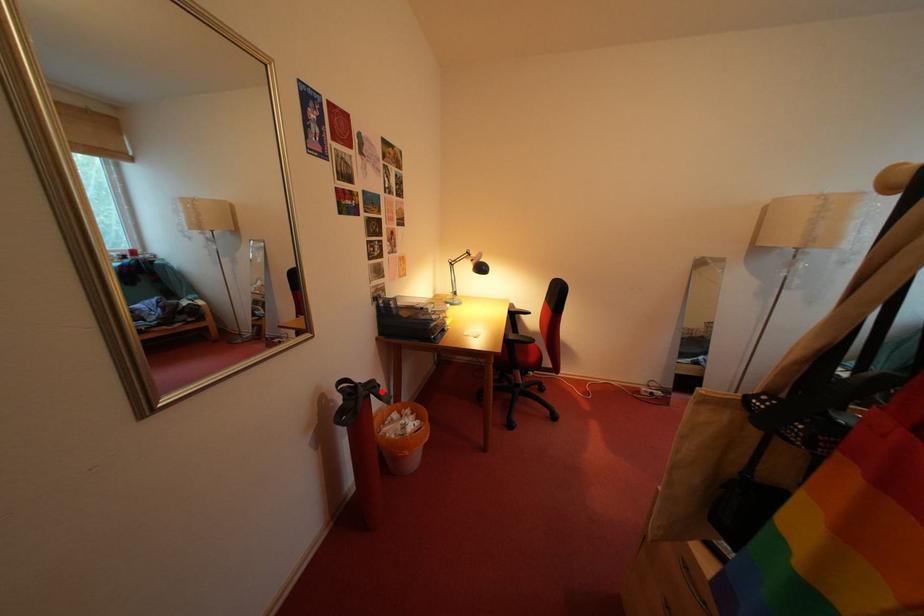
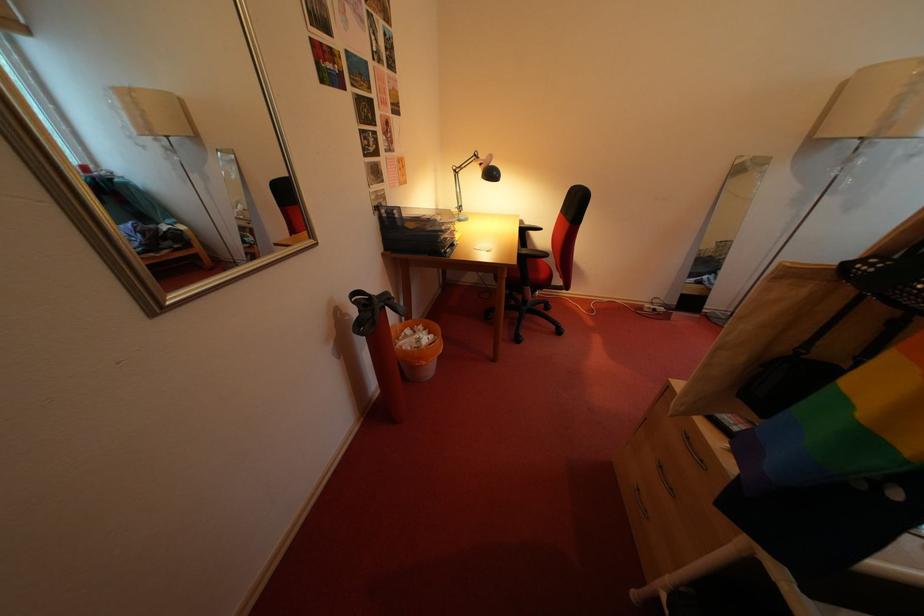
Question: A red point is marked in image1. In image2, is the corresponding 3D point closer to the camera or farther? Reply with the corresponding letter.

Choices:
 (A) The corresponding 3D point is closer.
 (B) The corresponding 3D point is farther.

Answer: (A)